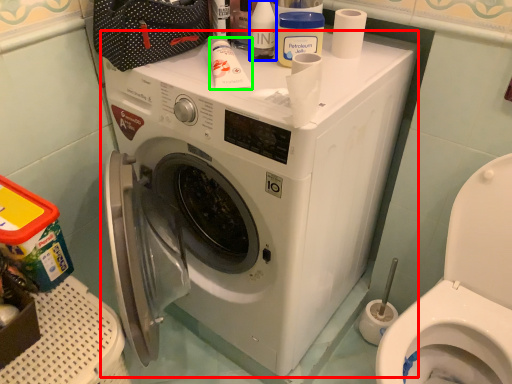
Question: Which object is positioned closest to washing machine (highlighted by a red box)? Select from toiletry (highlighted by a blue box) and toiletry (highlighted by a green box).

Choices:
 (A) toiletry
 (B) toiletry

Answer: (B)